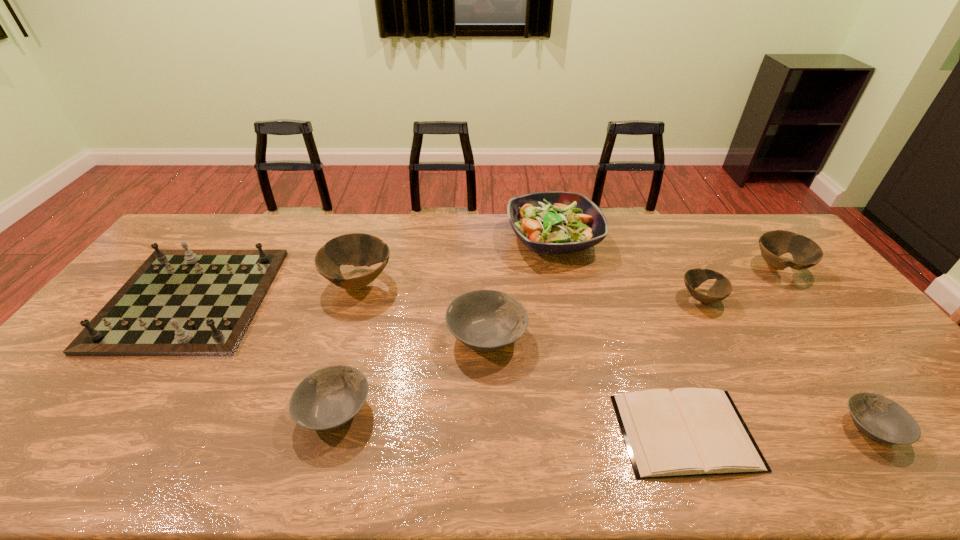
Select which gray bowl appears as the second closest to the rightmost gray bowl. Please provide its 2D coordinates. Your answer should be formatted as a tuple, i.e. [(x, y)], where the tuple contains the x and y coordinates of a point satisfying the conditions above.

[(327, 399)]

Select which gray bowl is the second closest to the smallest gray bowl. Please provide its 2D coordinates. Your answer should be formatted as a tuple, i.e. [(x, y)], where the tuple contains the x and y coordinates of a point satisfying the conditions above.

[(327, 399)]

The height and width of the screenshot is (540, 960). Find the location of `vacant region that satisfies the following two spatial constraints: 1. on the board of the second gray bowl from left to right; 2. on the right side of the black chessboard`. vacant region that satisfies the following two spatial constraints: 1. on the board of the second gray bowl from left to right; 2. on the right side of the black chessboard is located at coordinates (164, 336).

Find the location of a particular element. free space that satisfies the following two spatial constraints: 1. on the back side of the second smallest gray bowl; 2. on the left side of the second brown bowl from right to left is located at coordinates pyautogui.click(x=367, y=298).

Locate an element on the screen. The height and width of the screenshot is (540, 960). blank space that satisfies the following two spatial constraints: 1. on the back side of the hardback book; 2. on the right side of the smallest brown bowl is located at coordinates (635, 298).

In order to click on free space that satisfies the following two spatial constraints: 1. on the board of the leftmost object; 2. on the left side of the shortest object in this screenshot , I will do click(x=96, y=432).

Identify the location of free space that satisfies the following two spatial constraints: 1. on the board of the chessboard; 2. on the right side of the second gray bowl from left to right. (164, 336).

Find the location of a particular element. Image resolution: width=960 pixels, height=540 pixels. vacant space that satisfies the following two spatial constraints: 1. on the board of the hardback book; 2. on the right side of the leftmost object is located at coordinates (96, 432).